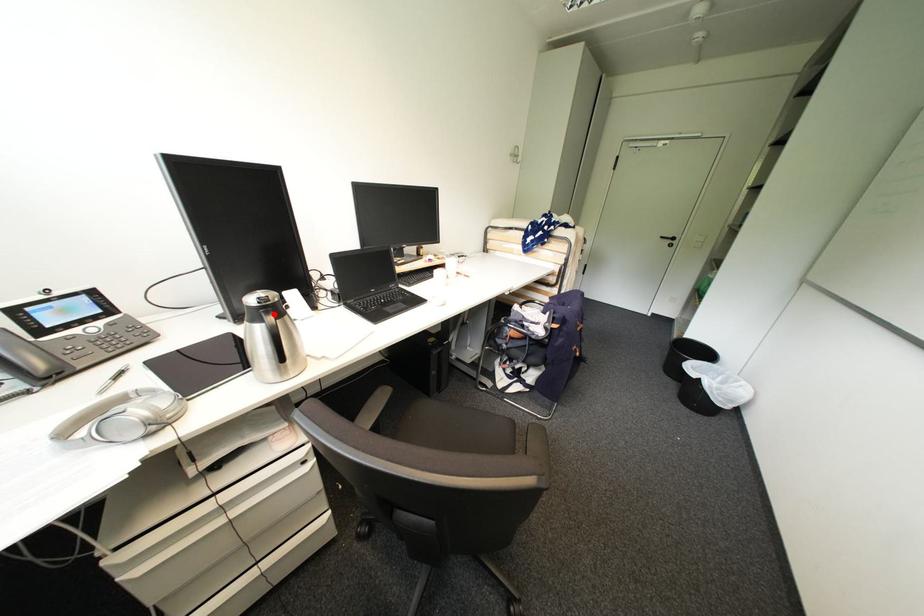
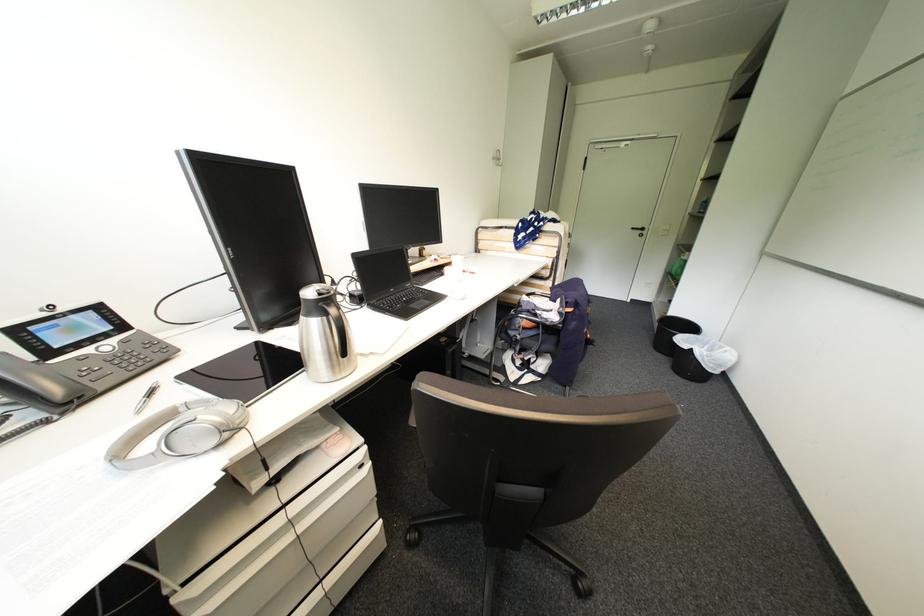
The point at the highlighted location is marked in the first image. Where is the corresponding point in the second image?

(334, 306)